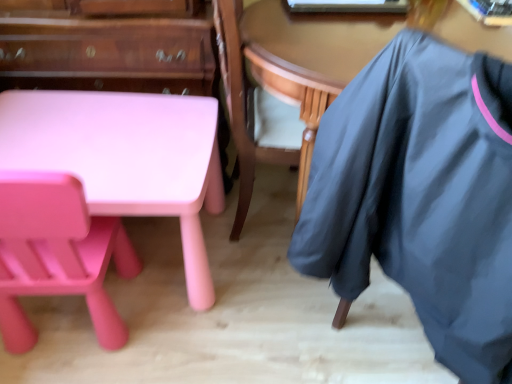
The image size is (512, 384). What are the coordinates of `blank space situated above matte pink plastic desk at lower left (from a real-world perspective)` in the screenshot? It's located at (97, 137).